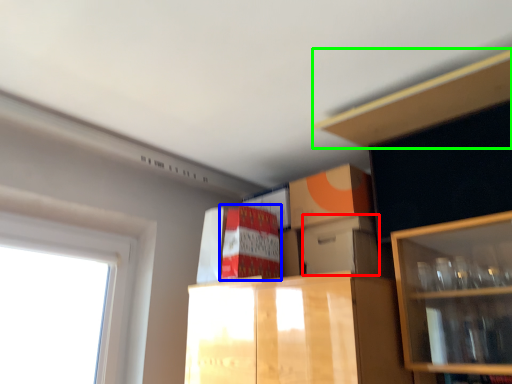
Question: Considering the real-world distances, which object is farthest from storage box (highlighted by a red box)? cabinetry (highlighted by a blue box) or cabinet (highlighted by a green box)?

Choices:
 (A) cabinetry
 (B) cabinet

Answer: (B)